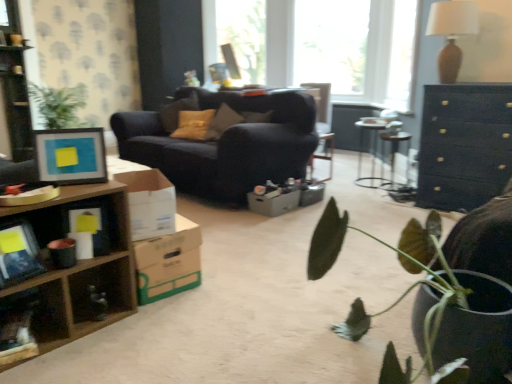
Where is `brown textured lamp at upper right`? brown textured lamp at upper right is located at coordinates (452, 33).

Where is `dark fabric couch at center`? This screenshot has height=384, width=512. dark fabric couch at center is located at coordinates (225, 145).

The image size is (512, 384). What do you see at coordinates (273, 203) in the screenshot? I see `cardboard box at center, the third cardboard box from the left` at bounding box center [273, 203].

Identify the location of green matte plant at lower right. Image resolution: width=512 pixels, height=384 pixels. (443, 290).

The width and height of the screenshot is (512, 384). I want to click on metallic silver desk at center, so click(x=372, y=152).

From the image's perspective, is dark wood dresser at upper right on top of cardboard box at center, which appears as the 3th cardboard box when viewed from the front?

Correct, dark wood dresser at upper right appears higher than cardboard box at center, which appears as the 3th cardboard box when viewed from the front, in the image.

Is dark wood dresser at upper right oriented towards cardboard box at center, the third cardboard box from the left?

No, dark wood dresser at upper right does not turn towards cardboard box at center, the third cardboard box from the left.

Considering the positions of objects dark wood dresser at upper right and cardboard box at center, the third cardboard box from the left, in the image provided, who is more to the left, dark wood dresser at upper right or cardboard box at center, the third cardboard box from the left,?

cardboard box at center, the third cardboard box from the left, is more to the left.

From a real-world perspective, is dark wood dresser at upper right below cardboard box at center, the third cardboard box from the left?

No, from a real-world perspective, dark wood dresser at upper right is not below cardboard box at center, the third cardboard box from the left.

Is wooden bookshelf at left directly adjacent to dark fabric couch at center?

wooden bookshelf at left and dark fabric couch at center are not in contact.

Could you tell me if wooden bookshelf at left is facing dark fabric couch at center?

No, wooden bookshelf at left is not facing towards dark fabric couch at center.

From the image's perspective, is wooden bookshelf at left on top of dark fabric couch at center?

Indeed, from the image's perspective, wooden bookshelf at left is shown above dark fabric couch at center.

From the picture: From a real-world perspective, which is physically below, wooden bookshelf at left or dark fabric couch at center?

dark fabric couch at center.

Considering the relative sizes of green matte plant at lower right and white cardboard box at center, which is counted as the 1th cardboard box, starting from the left, in the image provided, is green matte plant at lower right shorter than white cardboard box at center, which is counted as the 1th cardboard box, starting from the left,?

No, green matte plant at lower right is not shorter than white cardboard box at center, which is counted as the 1th cardboard box, starting from the left.

Which is behind, green matte plant at lower right or white cardboard box at center, which is the third cardboard box in right-to-left order?

white cardboard box at center, which is the third cardboard box in right-to-left order, is behind.

Which of these two, green matte plant at lower right or white cardboard box at center, marked as the third cardboard box in a back-to-front arrangement, is wider?

With larger width is green matte plant at lower right.

From the image's perspective, is green matte plant at lower right positioned above or below white cardboard box at center, which is counted as the 1th cardboard box, starting from the left?

green matte plant at lower right is situated lower than white cardboard box at center, which is counted as the 1th cardboard box, starting from the left, in the image.

Looking at this image, which point is more distant from viewer, (255, 193) or (358, 180)?

Positioned behind is point (358, 180).

How many degrees apart are the facing directions of cardboard box at center, which ranks as the first cardboard box in back-to-front order, and metallic silver desk at center?

The facing directions of cardboard box at center, which ranks as the first cardboard box in back-to-front order, and metallic silver desk at center are 90.8 degrees apart.

In terms of height, does cardboard box at center, arranged as the first cardboard box when viewed from the right, look taller or shorter compared to metallic silver desk at center?

Clearly, cardboard box at center, arranged as the first cardboard box when viewed from the right, is shorter compared to metallic silver desk at center.

Looking at their sizes, would you say cardboard box at center, which ranks as the first cardboard box in back-to-front order, is wider or thinner than metallic silver desk at center?

Considering their sizes, cardboard box at center, which ranks as the first cardboard box in back-to-front order, looks slimmer than metallic silver desk at center.

Is cardboard box at lower left, which appears as the 2th cardboard box when viewed from the left, directly adjacent to green matte plant at lower right?

cardboard box at lower left, which appears as the 2th cardboard box when viewed from the left, and green matte plant at lower right are not in contact.

Between cardboard box at lower left, which is the second cardboard box in back-to-front order, and green matte plant at lower right, which one appears on the left side from the viewer's perspective?

Positioned to the left is cardboard box at lower left, which is the second cardboard box in back-to-front order.

Considering their positions, is cardboard box at lower left, which is counted as the second cardboard box, starting from the right, located in front of or behind green matte plant at lower right?

cardboard box at lower left, which is counted as the second cardboard box, starting from the right, is positioned farther from the viewer than green matte plant at lower right.

Is cardboard box at lower left, which is counted as the second cardboard box, starting from the right, bigger than green matte plant at lower right?

Incorrect, cardboard box at lower left, which is counted as the second cardboard box, starting from the right, is not larger than green matte plant at lower right.

From the image's perspective, is brown textured lamp at upper right located above or below matte brown pillow at center?

brown textured lamp at upper right is above matte brown pillow at center.

Is brown textured lamp at upper right next to matte brown pillow at center?

They are not placed beside each other.

Is matte brown pillow at center at the back of brown textured lamp at upper right?

No, brown textured lamp at upper right's orientation is not away from matte brown pillow at center.

In the scene shown: Can we say brown textured lamp at upper right lies outside matte brown pillow at center?

Yes, brown textured lamp at upper right is not within matte brown pillow at center.

Is point (9, 92) farther from viewer compared to point (442, 17)?

No, it is not.

Considering their positions, is wooden bookshelf at left located in front of or behind brown textured lamp at upper right?

Clearly, wooden bookshelf at left is behind brown textured lamp at upper right.

Find the location of a particular element. file cabinet on the left side of brown textured lamp at upper right is located at coordinates (16, 102).

How many degrees apart are the facing directions of wooden bookshelf at left and brown textured lamp at upper right?

They differ by 87.1 degrees in their facing directions.

Locate an element on the screen. The width and height of the screenshot is (512, 384). cardboard box that is the 1st one when counting leftward from the dark wood dresser at upper right is located at coordinates (273, 203).

The width and height of the screenshot is (512, 384). Find the location of `studio couch in front of the wooden bookshelf at left`. studio couch in front of the wooden bookshelf at left is located at coordinates (225, 145).

Looking at the image, which one is located closer to brown textured lamp at upper right, metallic silver desk at center or cardboard box at center, arranged as the first cardboard box when viewed from the right?

Among the two, metallic silver desk at center is located nearer to brown textured lamp at upper right.

Considering their positions, is wooden bookshelf at left positioned closer to cardboard box at center, which appears as the 3th cardboard box when viewed from the front, than matte black picture frame at left?

Among the two, matte black picture frame at left is located nearer to cardboard box at center, which appears as the 3th cardboard box when viewed from the front.

When comparing their distances from brown textured lamp at upper right, does cardboard box at lower left, which ranks as the second cardboard box in front-to-back order, or dark fabric couch at center seem further?

The object further to brown textured lamp at upper right is cardboard box at lower left, which ranks as the second cardboard box in front-to-back order.

Based on their spatial positions, is cardboard box at lower left, which ranks as the second cardboard box in front-to-back order, or wooden bookshelf at left closer to wooden shelf at lower left?

cardboard box at lower left, which ranks as the second cardboard box in front-to-back order, is closer to wooden shelf at lower left.

Considering their positions, is cardboard box at lower left, which ranks as the second cardboard box in front-to-back order, positioned closer to matte brown pillow at center than white cardboard box at center, which is counted as the 1th cardboard box, starting from the left?

cardboard box at lower left, which ranks as the second cardboard box in front-to-back order, lies closer to matte brown pillow at center than the other object.

Estimate the real-world distances between objects in this image. Which object is closer to dark wood dresser at upper right, green matte plant at lower right or wooden shelf at lower left?

green matte plant at lower right.

From the image, which object appears to be nearer to brown textured lamp at upper right, matte black picture frame at left or wooden bookshelf at left?

matte black picture frame at left is positioned closer to the anchor brown textured lamp at upper right.

Looking at the image, which one is located closer to cardboard box at lower left, which is the second cardboard box in back-to-front order, wooden bookshelf at left or metallic silver desk at center?

The object closer to cardboard box at lower left, which is the second cardboard box in back-to-front order, is wooden bookshelf at left.

Locate an element on the screen. desk located between matte black picture frame at left and dark wood dresser at upper right in the left-right direction is located at coordinates (372, 152).

Find the location of `pillow between green matte plant at lower right and wooden bookshelf at left from front to back`. pillow between green matte plant at lower right and wooden bookshelf at left from front to back is located at coordinates (177, 111).

You are a GUI agent. You are given a task and a screenshot of the screen. Output one action in this format:
    pyautogui.click(x=<x>, y=<y>)
    Task: Click on the pillow between matte black picture frame at left and brown textured lamp at upper right in the horizontal direction
    This screenshot has height=384, width=512.
    Given the screenshot: What is the action you would take?
    pyautogui.click(x=177, y=111)

I want to click on lamp located between green matte plant at lower right and cardboard box at center, which ranks as the first cardboard box in back-to-front order, in the depth direction, so click(x=452, y=33).